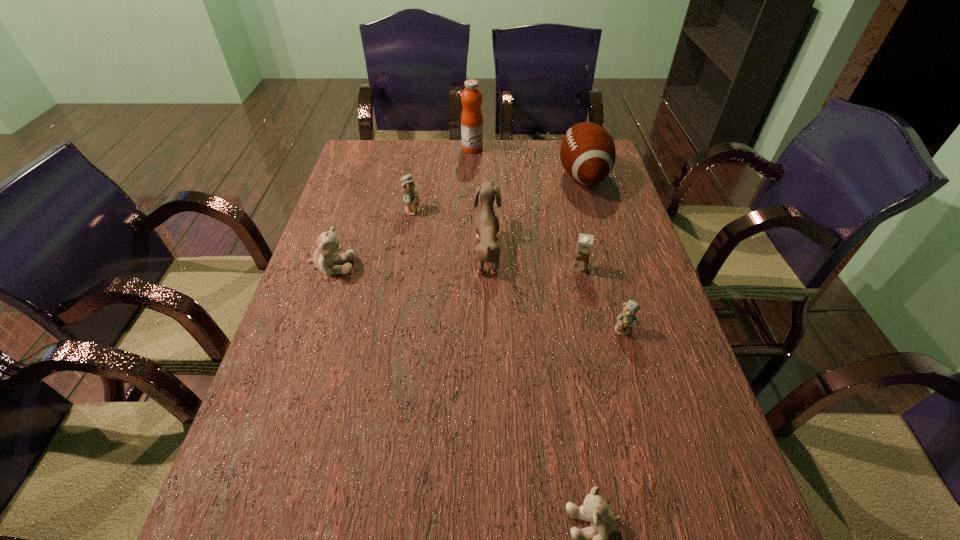
Locate an element on the screen. This screenshot has height=540, width=960. object that is the fifth closest to the puppy is located at coordinates (324, 259).

Locate an element on the screen. object that can be found as the closest to the chocolate milk is located at coordinates (627, 319).

Locate an element on the screen. The width and height of the screenshot is (960, 540). teddy bear that is the third nearest to the fruit juice is located at coordinates (627, 319).

This screenshot has height=540, width=960. I want to click on the closest teddy bear to the third farthest teddy bear, so click(593, 539).

Locate an element on the screen. The width and height of the screenshot is (960, 540). vacant position in the image that satisfies the following two spatial constraints: 1. on the front label of the chocolate milk; 2. on the right side of the fruit juice is located at coordinates (469, 269).

The image size is (960, 540). What are the coordinates of `free region that satisfies the following two spatial constraints: 1. on the back side of the chocolate milk; 2. on the face of the third nearest teddy bear` in the screenshot? It's located at (579, 267).